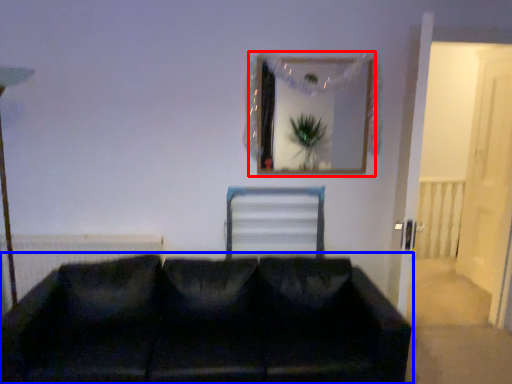
Question: Which object appears closest to the camera in this image, picture frame (highlighted by a red box) or studio couch (highlighted by a blue box)?

Choices:
 (A) picture frame
 (B) studio couch

Answer: (B)